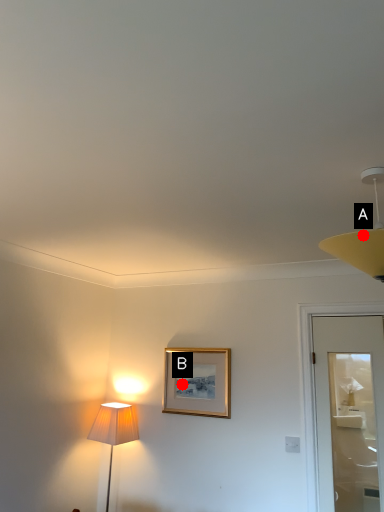
Question: Two points are circled on the image, labeled by A and B beside each circle. Among these points, which one is farthest from the camera?

Choices:
 (A) A is further
 (B) B is further

Answer: (B)